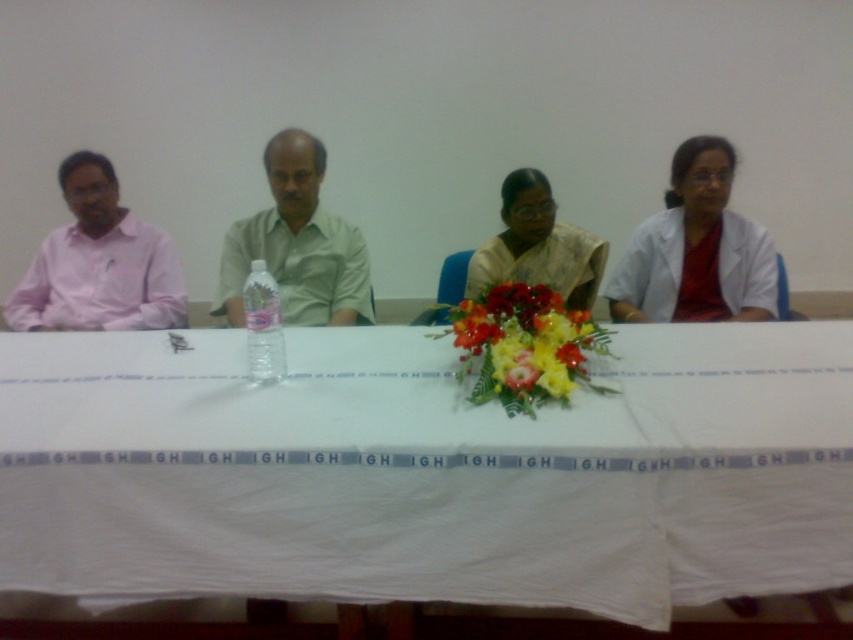
You are a photographer at a formal event. You need to capture a photo of the white matte coat at right and the satin yellow saree at center. Based on their positions, which one is located to the right of the other?

The white matte coat at right is positioned on the right side of the satin yellow saree at center.

You are organizing a photo shoot and need to place a large camera on the table. The camera requires a space wider than the wider object between the white matte coat at right and the satin yellow saree at center. Where should you place the camera?

The white matte coat at right might be wider than the satin yellow saree at center, so you should place the camera next to the white matte coat at right to ensure there is enough space.

You are organizing a photo shoot and need to place a small prop between the white matte coat at right and the pink matte shirt at left. Given their widths, which side of the prop should be closer to the narrower object to ensure balance?

The white matte coat at right is narrower than the pink matte shirt at left. To balance the composition, the prop should be placed closer to the white matte coat at right since it is narrower, allowing the wider pink matte shirt at left to visually counterbalance it.